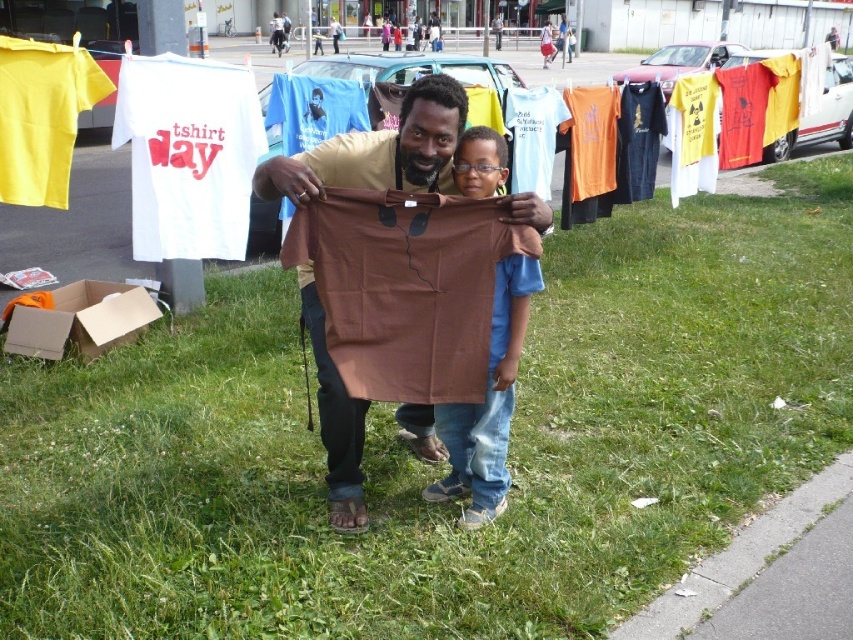
You are a photographer taking a picture of the scene. You need to decide whether to focus on the brown fabric shirt at center or the brown cardboard at lower left. Which object should you focus on if you want the thicker item to be in focus?

The brown cardboard at lower left is thicker than the brown fabric shirt at center, so you should focus on the brown cardboard at lower left to have the thicker item in focus.